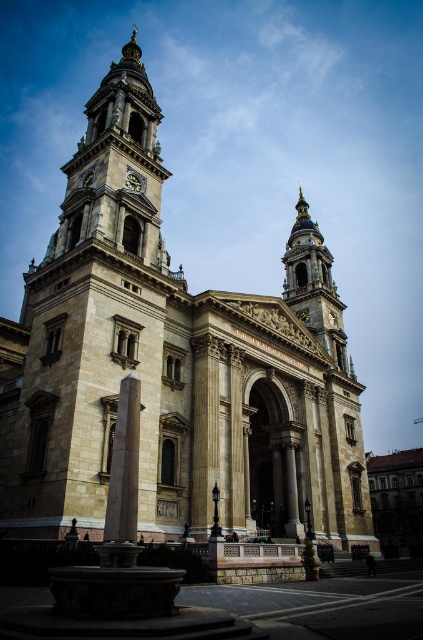
Question: Does golden stone tower at center appear over smooth stone column at center?

Choices:
 (A) yes
 (B) no

Answer: (A)

Question: Does golden stone tower at center appear on the right side of smooth stone column at center?

Choices:
 (A) yes
 (B) no

Answer: (A)

Question: Which point is farther to the camera?

Choices:
 (A) (288, 266)
 (B) (128, 385)

Answer: (A)

Question: Can you confirm if golden stone tower at center is wider than smooth stone column at center?

Choices:
 (A) yes
 (B) no

Answer: (A)

Question: Which of the following is the farthest from the observer?

Choices:
 (A) golden stone tower at center
 (B) smooth stone column at center

Answer: (A)